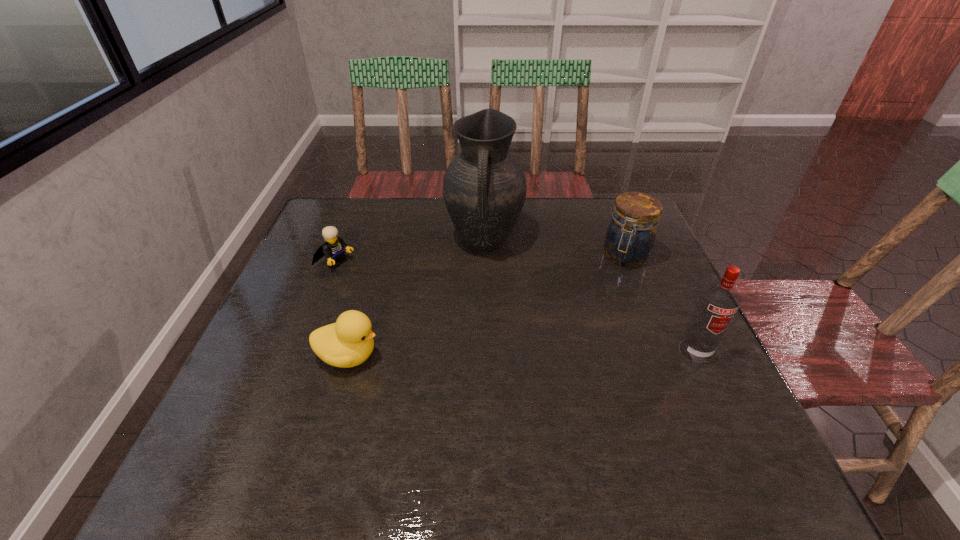
Where is `vodka located at the right edge`? The image size is (960, 540). vodka located at the right edge is located at coordinates (717, 304).

The height and width of the screenshot is (540, 960). I want to click on jar at the right edge, so [630, 237].

Locate an element on the screen. The width and height of the screenshot is (960, 540). free space at the far edge of the desktop is located at coordinates (416, 217).

This screenshot has width=960, height=540. Identify the location of blank space at the near edge of the desktop. (388, 430).

In order to click on free space at the left edge of the desktop in this screenshot , I will do click(x=313, y=323).

Image resolution: width=960 pixels, height=540 pixels. In the image, there is a desktop. What are the coordinates of `free space at the right edge` in the screenshot? It's located at (637, 318).

This screenshot has height=540, width=960. In order to click on vacant area at the far left corner of the desktop in this screenshot , I will do `click(328, 220)`.

The width and height of the screenshot is (960, 540). Identify the location of vacant space at the near left corner of the desktop. (221, 427).

Identify the location of vacant space in between the vodka and the Lego. (516, 306).

This screenshot has height=540, width=960. Find the location of `free space between the third tallest object and the second tallest object`. free space between the third tallest object and the second tallest object is located at coordinates (660, 303).